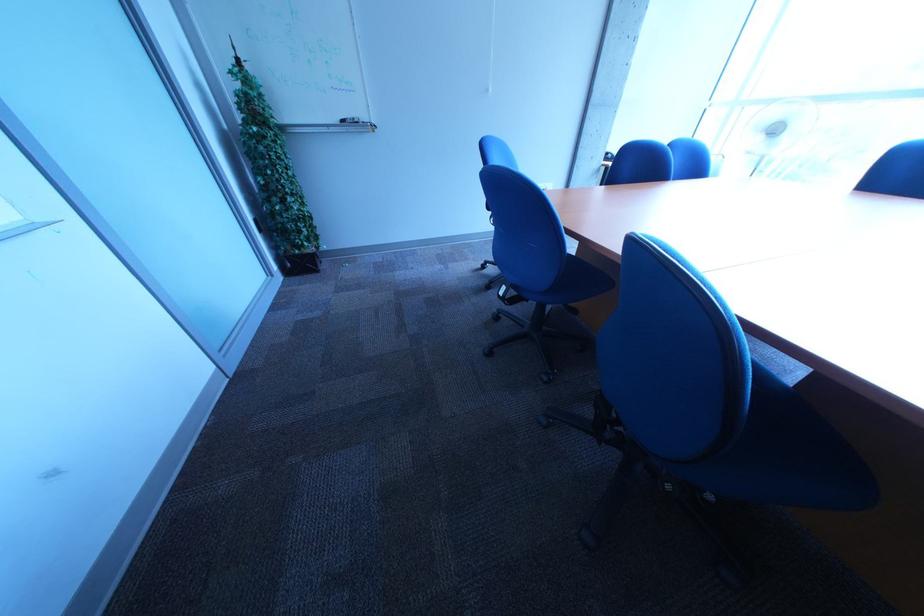
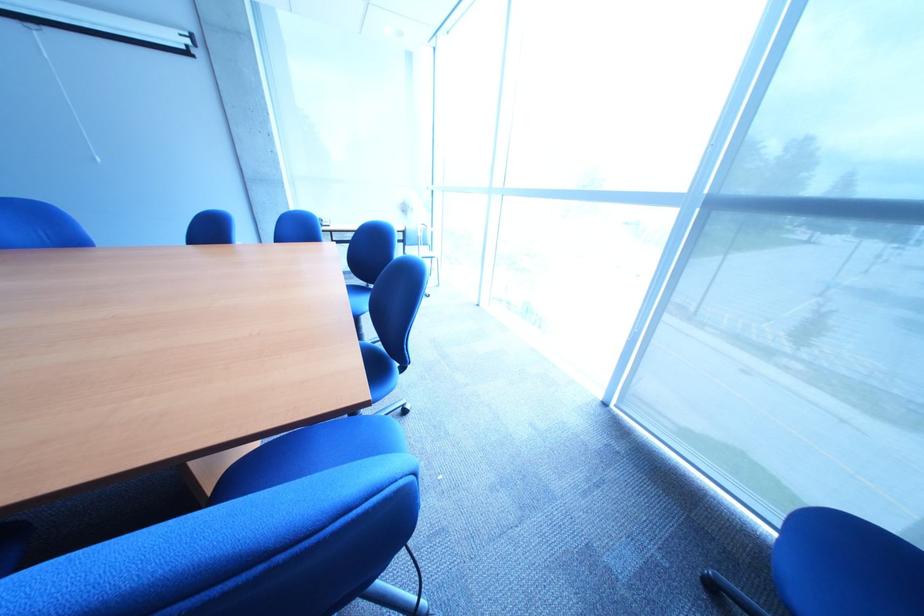
Question: Which direction would the cameraman need to move to produce the second image? Reply with the corresponding letter.

Choices:
 (A) Left
 (B) Right
 (C) Forward
 (D) Backward

Answer: (B)